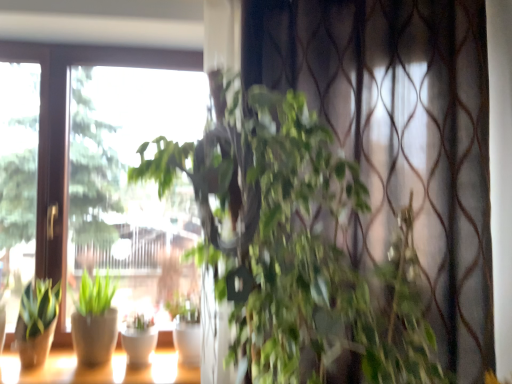
Question: From their relative heights in the image, would you say white glossy flowerpot at center is taller or shorter than green matte plant at lower left, which is the second houseplant from back to front?

Choices:
 (A) short
 (B) tall

Answer: (A)

Question: From a real-world perspective, is white glossy flowerpot at center positioned above or below green matte plant at lower left, arranged as the 3th houseplant when viewed from the right?

Choices:
 (A) below
 (B) above

Answer: (A)

Question: Which of these objects is positioned closest to the green leafy plant at center, the 1th houseplant from the right?

Choices:
 (A) matte white pots at lower left
 (B) green matte plant at center, the 3th houseplant positioned from the front
 (C) green matte plant at lower left, the 2th houseplant positioned from the front
 (D) white glossy flowerpot at center

Answer: (B)

Question: Based on their relative distances, which object is nearer to the matte white pots at lower left?

Choices:
 (A) green leafy plant at center, positioned as the 3th houseplant in left-to-right order
 (B) white glossy flowerpot at center
 (C) green matte plant at lower left, the 1th houseplant from the left
 (D) green matte plant at center, which is the 2th houseplant from right to left

Answer: (B)